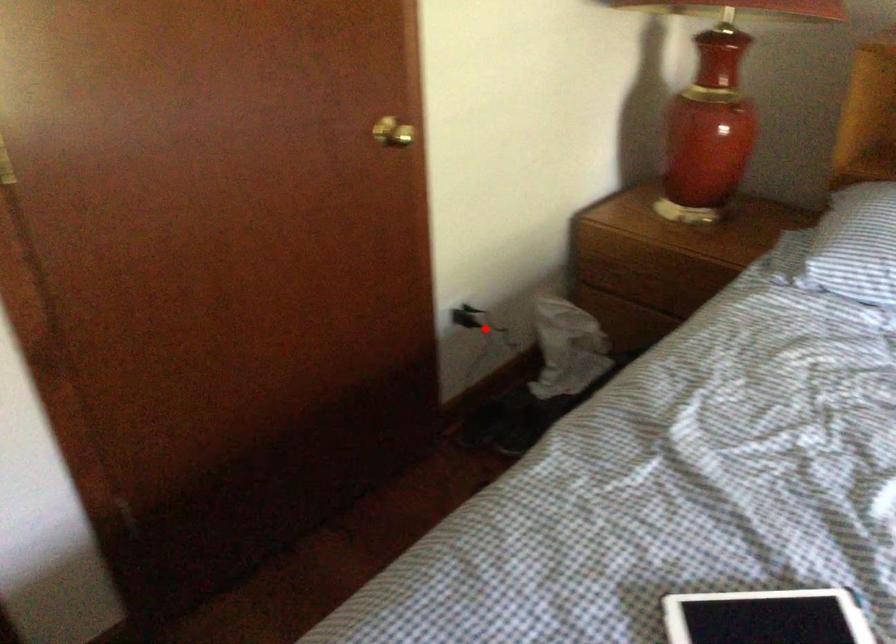
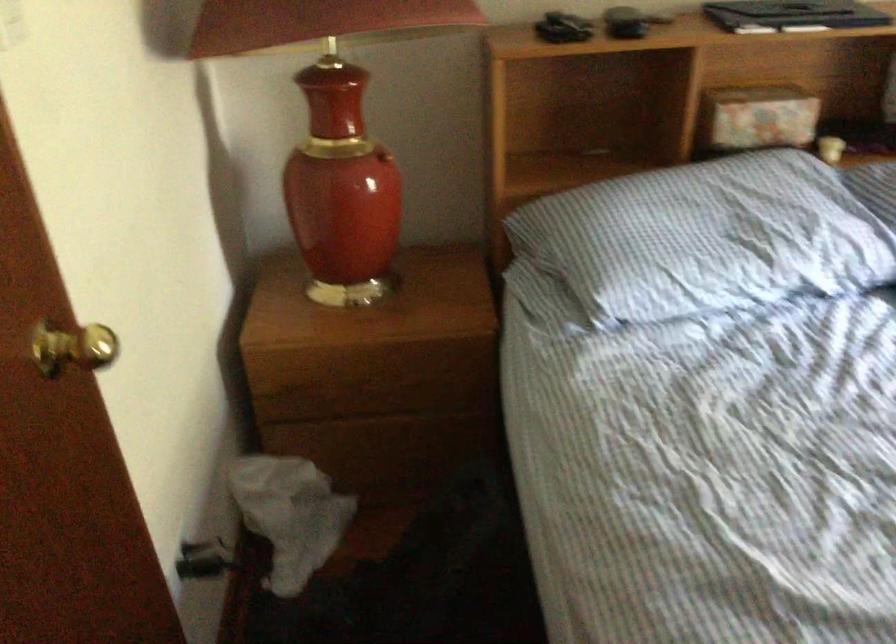
Question: I am providing you with two images of the same scene from different viewpoints. Given a red point in image1, look at the same physical point in image2. Is it:

Choices:
 (A) Closer to the viewpoint
 (B) Farther from the viewpoint

Answer: (A)